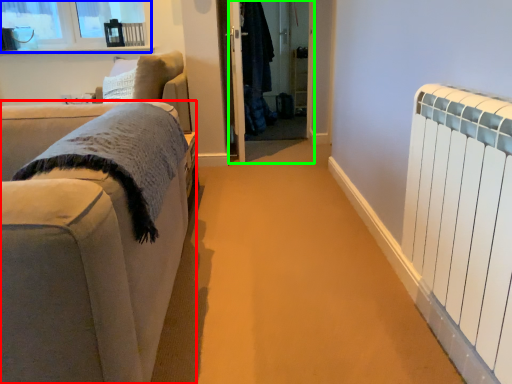
Question: Which object is the farthest from studio couch (highlighted by a red box)? Choose among these: window (highlighted by a blue box) or screen door (highlighted by a green box).

Choices:
 (A) window
 (B) screen door

Answer: (A)